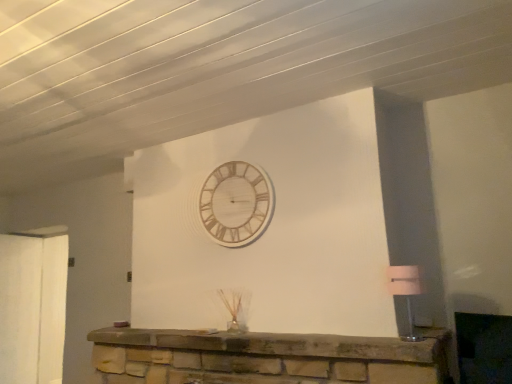
Question: Looking at their shapes, would you say matte white lampshade at right is wider or thinner than stone fireplace at center?

Choices:
 (A) wide
 (B) thin

Answer: (B)

Question: From a real-world perspective, relative to stone fireplace at center, is matte white lampshade at right vertically above or below?

Choices:
 (A) below
 (B) above

Answer: (B)

Question: Based on their relative distances, which object is farther from the wooden/textured wall clock at upper center?

Choices:
 (A) stone fireplace at center
 (B) matte white lampshade at right

Answer: (B)

Question: Estimate the real-world distances between objects in this image. Which object is closer to the wooden/textured wall clock at upper center?

Choices:
 (A) stone fireplace at center
 (B) matte white lampshade at right

Answer: (A)